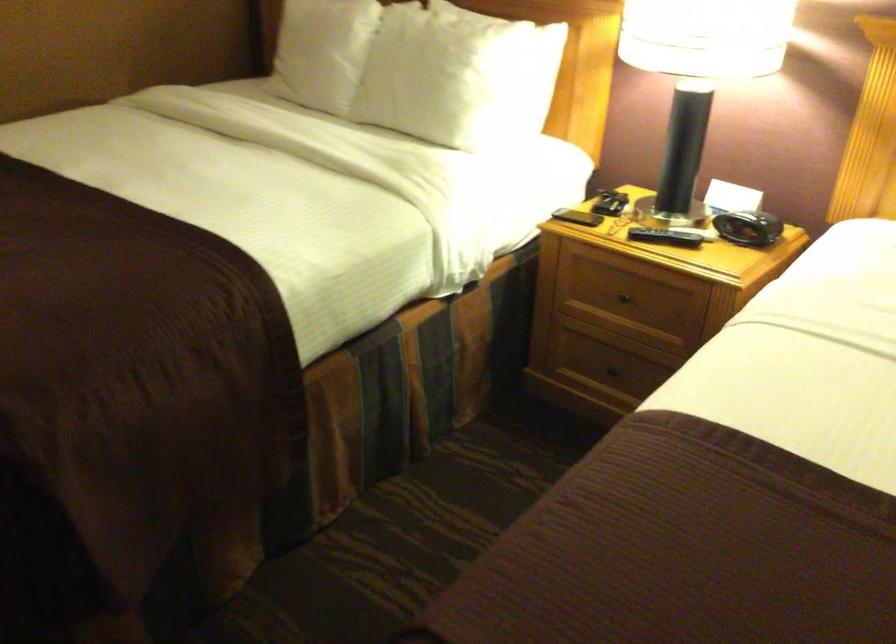
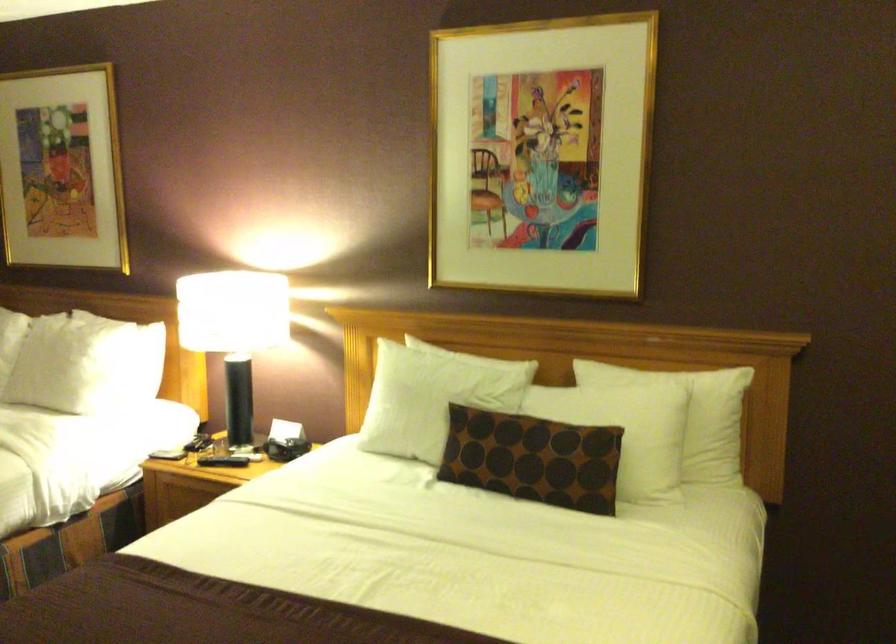
Locate, in the second image, the point that corresponds to [453,82] in the first image.

(73, 364)